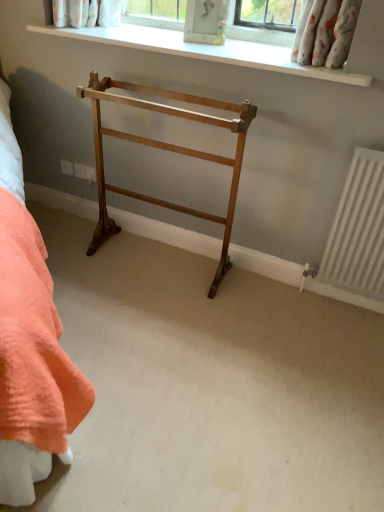
What do you see at coordinates (166, 150) in the screenshot? This screenshot has height=512, width=384. I see `light brown wood towel rack at center` at bounding box center [166, 150].

The image size is (384, 512). What are the coordinates of `light brown wood towel rack at center` in the screenshot? It's located at (166, 150).

Find the location of a particular element. white smooth window sill at upper center is located at coordinates [x=205, y=50].

What do you see at coordinates (205, 50) in the screenshot?
I see `white smooth window sill at upper center` at bounding box center [205, 50].

Where is `light brown wood towel rack at center`? light brown wood towel rack at center is located at coordinates tap(166, 150).

Based on the photo, considering the positions of objects light brown wood towel rack at center and white smooth window sill at upper center in the image provided, who is more to the right, light brown wood towel rack at center or white smooth window sill at upper center?

From the viewer's perspective, white smooth window sill at upper center appears more on the right side.

In the scene shown: Is the position of light brown wood towel rack at center more distant than that of white smooth window sill at upper center?

No, light brown wood towel rack at center is in front of white smooth window sill at upper center.

Is point (234, 205) in front of point (254, 42)?

No, it is not.

From the image's perspective, which one is positioned lower, light brown wood towel rack at center or white smooth window sill at upper center?

From the image's view, light brown wood towel rack at center is below.

From a real-world perspective, is light brown wood towel rack at center physically below white smooth window sill at upper center?

Yes, from a real-world perspective, light brown wood towel rack at center is below white smooth window sill at upper center.

Which object is thinner, light brown wood towel rack at center or white smooth window sill at upper center?

light brown wood towel rack at center.

Which of these two, light brown wood towel rack at center or white smooth window sill at upper center, stands taller?

light brown wood towel rack at center is taller.

Does light brown wood towel rack at center have a smaller size compared to white smooth window sill at upper center?

Actually, light brown wood towel rack at center might be larger than white smooth window sill at upper center.

Which is correct: light brown wood towel rack at center is inside white smooth window sill at upper center, or outside of it?

light brown wood towel rack at center is not enclosed by white smooth window sill at upper center.

Would you consider light brown wood towel rack at center to be distant from white smooth window sill at upper center?

No.

Could you tell me if light brown wood towel rack at center is facing white smooth window sill at upper center?

No, light brown wood towel rack at center is not facing towards white smooth window sill at upper center.

Locate an element on the screen. window sill located above the light brown wood towel rack at center (from the image's perspective) is located at coordinates (205, 50).

Considering the positions of objects white smooth window sill at upper center and light brown wood towel rack at center in the image provided, who is more to the left, white smooth window sill at upper center or light brown wood towel rack at center?

light brown wood towel rack at center.

From the picture: In the image, is white smooth window sill at upper center positioned in front of or behind light brown wood towel rack at center?

Visually, white smooth window sill at upper center is located behind light brown wood towel rack at center.

Between point (288, 61) and point (100, 177), which one is positioned behind?

The point (100, 177) is farther from the camera.

From the image's perspective, is white smooth window sill at upper center beneath light brown wood towel rack at center?

No.

From a real-world perspective, between white smooth window sill at upper center and light brown wood towel rack at center, who is vertically higher?

white smooth window sill at upper center.

Which of these two, white smooth window sill at upper center or light brown wood towel rack at center, is wider?

white smooth window sill at upper center.

Considering the sizes of white smooth window sill at upper center and light brown wood towel rack at center in the image, is white smooth window sill at upper center taller or shorter than light brown wood towel rack at center?

white smooth window sill at upper center is shorter than light brown wood towel rack at center.

Is white smooth window sill at upper center bigger or smaller than light brown wood towel rack at center?

Clearly, white smooth window sill at upper center is smaller in size than light brown wood towel rack at center.

Is light brown wood towel rack at center completely or partially inside white smooth window sill at upper center?

Definitely not — light brown wood towel rack at center is not inside white smooth window sill at upper center.

Consider the image. Is white smooth window sill at upper center with light brown wood towel rack at center?

They are not placed beside each other.

Is white smooth window sill at upper center oriented towards light brown wood towel rack at center?

No, white smooth window sill at upper center does not turn towards light brown wood towel rack at center.

How different are the orientations of white smooth window sill at upper center and light brown wood towel rack at center in degrees?

There is a 0.000207-degree angle between the facing directions of white smooth window sill at upper center and light brown wood towel rack at center.

Where is `furniture in front of the white smooth window sill at upper center`? Image resolution: width=384 pixels, height=512 pixels. furniture in front of the white smooth window sill at upper center is located at coordinates (166, 150).

Where is `furniture below the white smooth window sill at upper center (from the image's perspective)`? This screenshot has width=384, height=512. furniture below the white smooth window sill at upper center (from the image's perspective) is located at coordinates (166, 150).

Where is `furniture below the white smooth window sill at upper center (from a real-world perspective)`? furniture below the white smooth window sill at upper center (from a real-world perspective) is located at coordinates click(x=166, y=150).